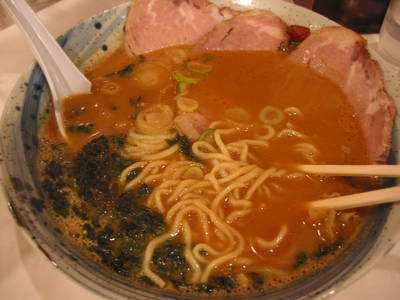
Where is `glass`? glass is located at coordinates (186, 79), (388, 44).